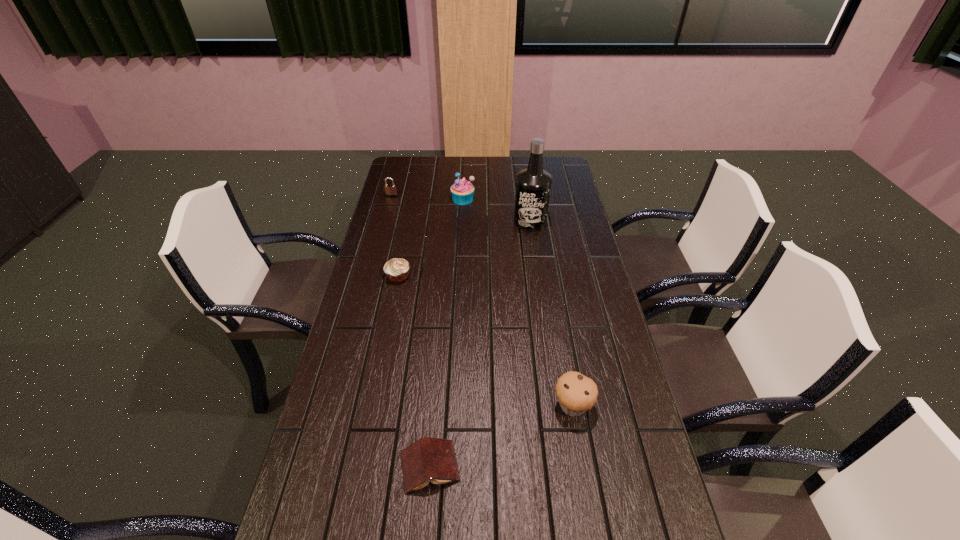
You are a GUI agent. You are given a task and a screenshot of the screen. Output one action in this format:
    pyautogui.click(x=<x>, y=<y>)
    Task: Click on the book
    This screenshot has height=540, width=960.
    Given the screenshot: What is the action you would take?
    pyautogui.click(x=428, y=459)

What are the coordinates of `blank space located 0.150m on the front label of the liquor` in the screenshot? It's located at (535, 257).

You are a GUI agent. You are given a task and a screenshot of the screen. Output one action in this format:
    pyautogui.click(x=<x>, y=<y>)
    Task: Click on the vacant area located on the front of the second muffin from right to left
    Image resolution: width=960 pixels, height=540 pixels.
    Given the screenshot: What is the action you would take?
    pyautogui.click(x=459, y=266)

Identify the location of free space located 0.220m on the left of the fifth farthest object. (469, 406).

Identify the location of free space located on the back of the padlock. (401, 159).

This screenshot has width=960, height=540. I want to click on vacant position located 0.280m on the front of the second farthest muffin, so click(x=383, y=351).

Find the location of a particular element. This screenshot has width=960, height=540. vacant area located 0.260m on the back of the book is located at coordinates (439, 356).

Where is `padlock positioned at the left edge`? The image size is (960, 540). padlock positioned at the left edge is located at coordinates (390, 189).

Where is `muffin that is at the left edge`? Image resolution: width=960 pixels, height=540 pixels. muffin that is at the left edge is located at coordinates (397, 269).

Locate an element on the screen. The height and width of the screenshot is (540, 960). liquor that is at the right edge is located at coordinates (533, 184).